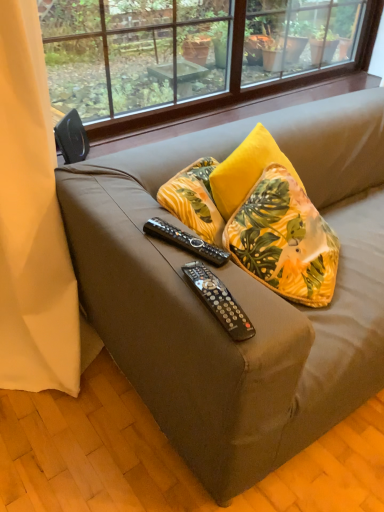
Identify the location of free spot behind black plastic remote at center, which is the 2th remote control in back-to-front order. (198, 258).